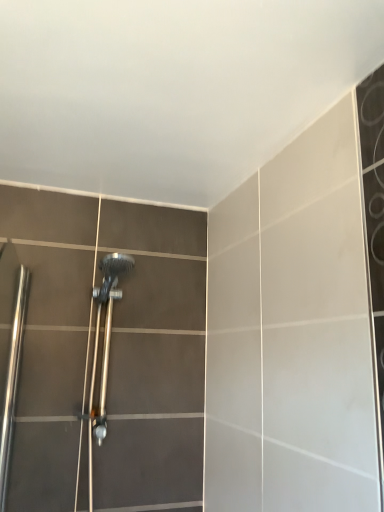
What is the approximate width of transparent glass shower head at center?

transparent glass shower head at center is 11.37 inches wide.

The width and height of the screenshot is (384, 512). What do you see at coordinates (109, 353) in the screenshot?
I see `transparent glass shower head at center` at bounding box center [109, 353].

The width and height of the screenshot is (384, 512). What are the coordinates of `transparent glass shower head at center` in the screenshot? It's located at (109, 353).

Where is `transparent glass shower head at center`? Image resolution: width=384 pixels, height=512 pixels. transparent glass shower head at center is located at coordinates (109, 353).